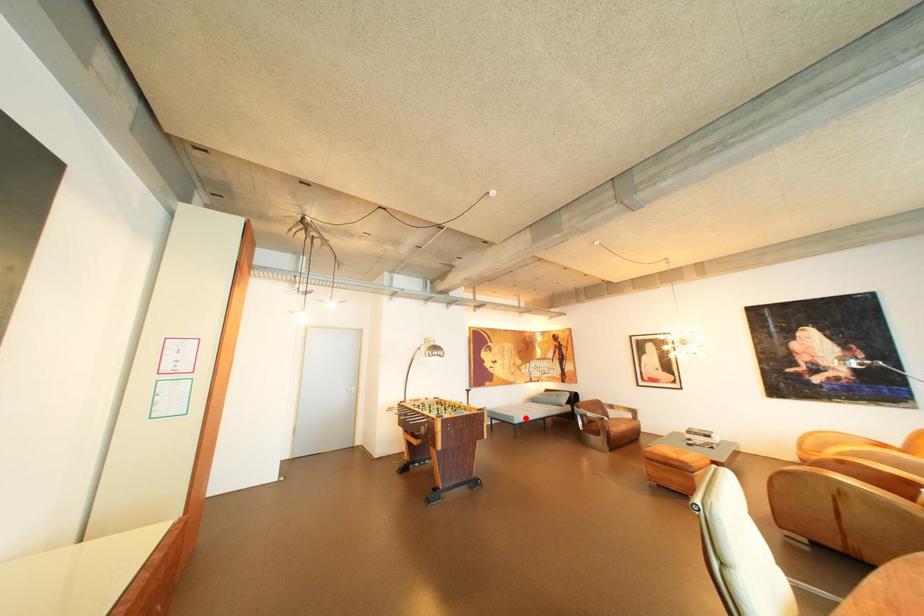
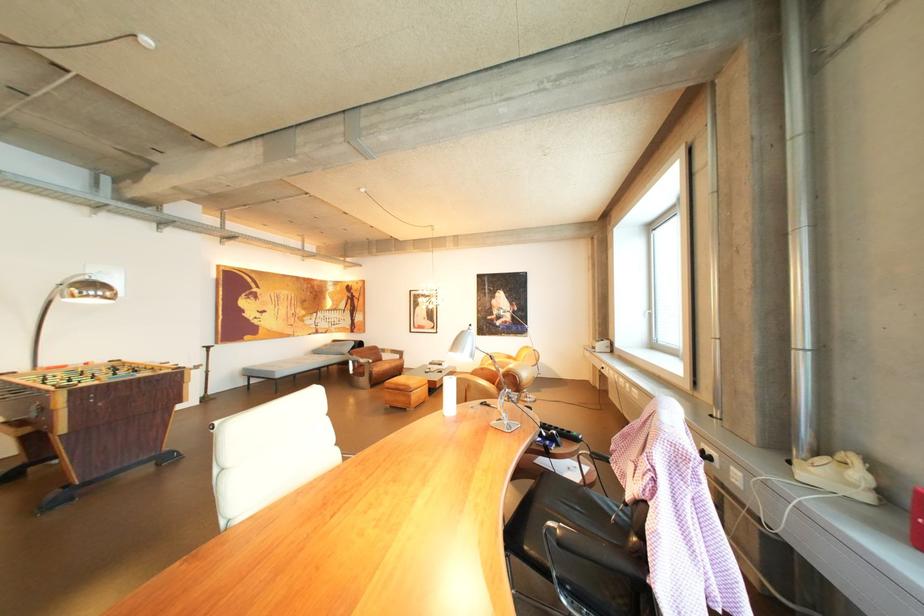
Question: I am providing you with two images of the same scene from different viewpoints. A red point is marked on the first image. Can you still see the location of the red point in image 2?

Choices:
 (A) Yes
 (B) No

Answer: (A)